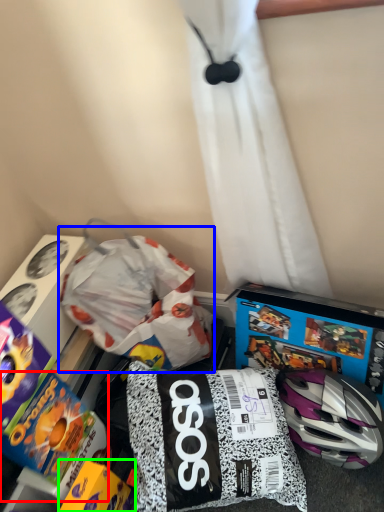
Question: Which is farther away from toy (highlighted by a red box)? waste (highlighted by a blue box) or toy (highlighted by a green box)?

Choices:
 (A) waste
 (B) toy

Answer: (A)